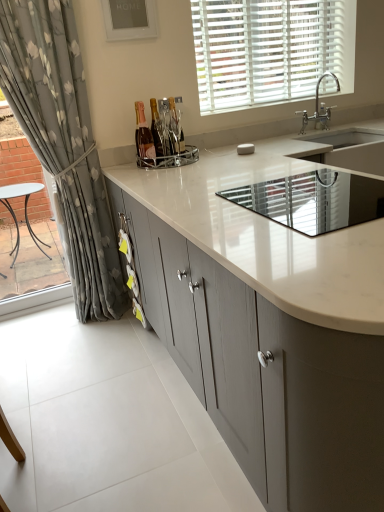
Image resolution: width=384 pixels, height=512 pixels. Find the location of `free space in front of floral fabric curtain at left`. free space in front of floral fabric curtain at left is located at coordinates (77, 357).